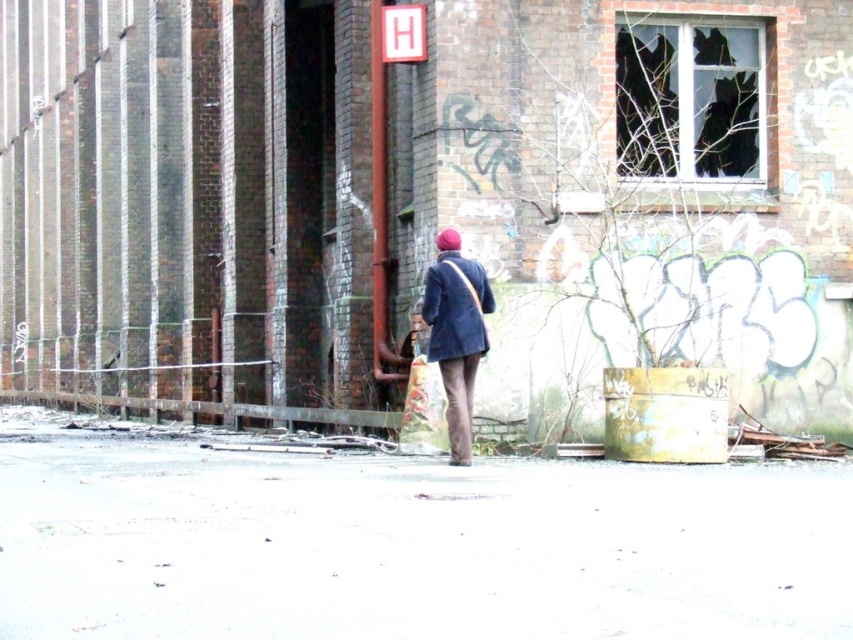
You are standing at the entrance of the building and need to locate the rusty metal fence at lower left. According to the coordinates provided, where should you look relative to your current position?

The rusty metal fence at lower left is located at coordinates point (213, 406), which means it is positioned to the left and slightly forward from your current position at the entrance.

You are a fashion designer observing the person in the scene. You notice the dark blue fabric coat at center and the dark blue woolen sweater at center. Which clothing item is worn over the other?

The dark blue woolen sweater at center is worn over the dark blue fabric coat at center because the coat is positioned under the sweater according to the description.